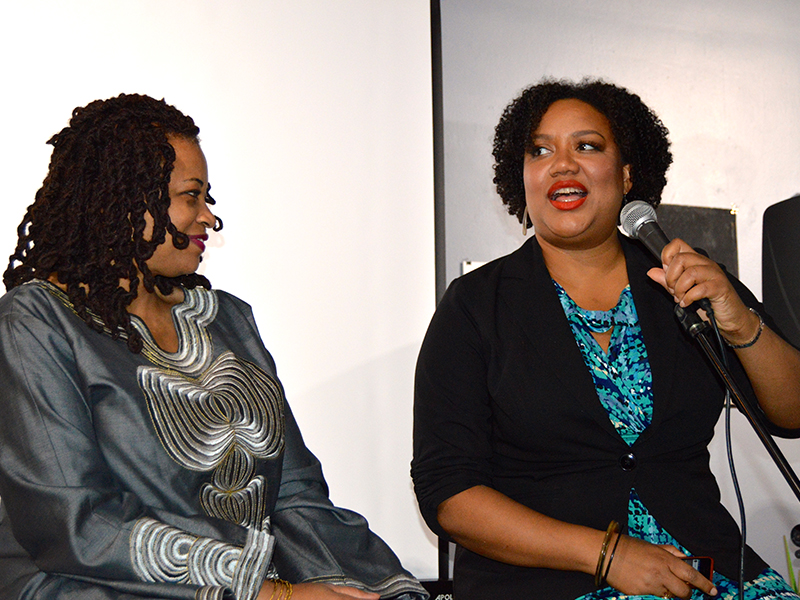
Where is `white wall`? The height and width of the screenshot is (600, 800). white wall is located at coordinates point(718,62), point(310,89), point(310,254).